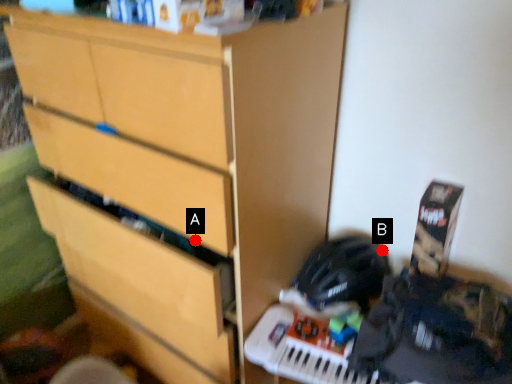
Question: Two points are circled on the image, labeled by A and B beside each circle. Among these points, which one is farthest from the camera?

Choices:
 (A) A is further
 (B) B is further

Answer: (B)